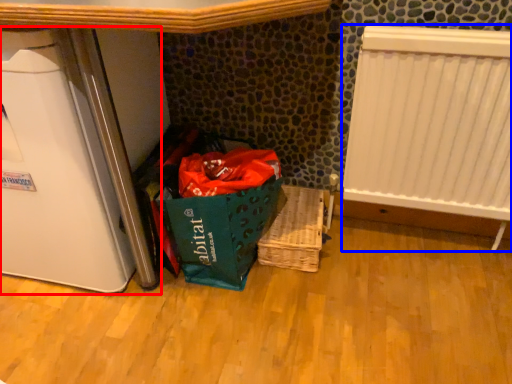
Question: Which object is further to the camera taking this photo, appliance (highlighted by a red box) or radiator (highlighted by a blue box)?

Choices:
 (A) appliance
 (B) radiator

Answer: (B)